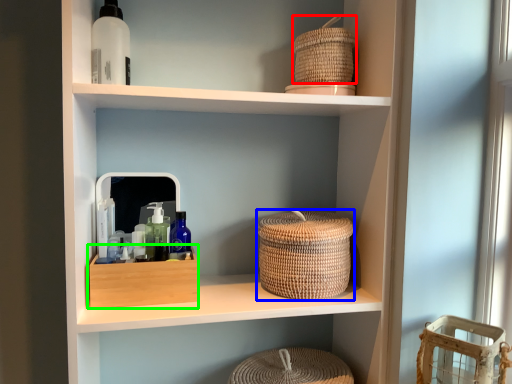
Question: Which object is positioned farthest from basket (highlighted by a red box)? Select from basket (highlighted by a blue box) and storage box (highlighted by a green box).

Choices:
 (A) basket
 (B) storage box

Answer: (B)